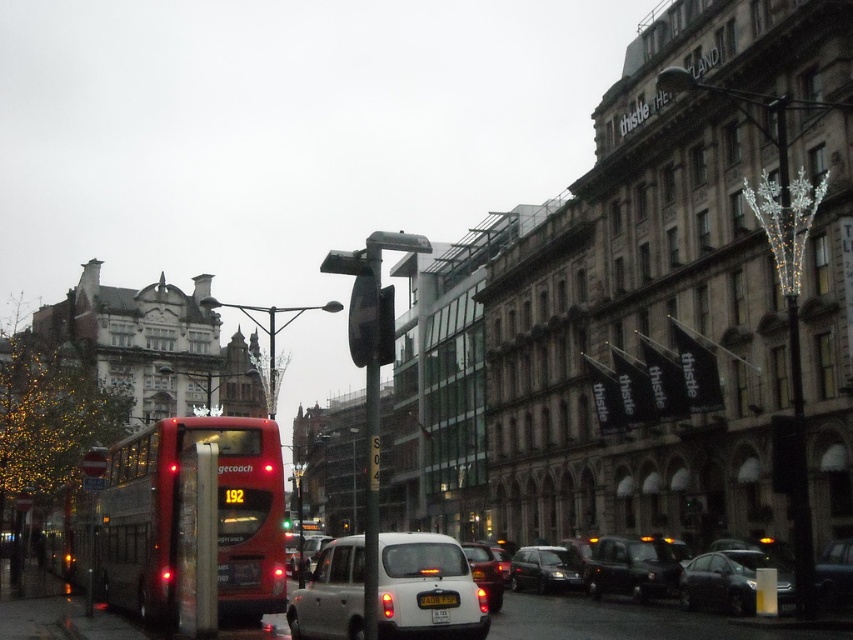
You are a pedestrian standing on the sidewalk and want to cross the street to reach the Thistle building. There is a white matte taxi at center and a metallic silver car at center in your path. Which vehicle should you move around first to reach the building safely?

The white matte taxi at center is closer to the viewer than the metallic silver car at center, so you should move around the white matte taxi at center first to reach the Thistle building safely.

You are a tourist in the city and notice two license plates on the bus. Which license plate, the white plastic license plate at center or the yellow matte license plate at center, is positioned to the right side of the bus?

The yellow matte license plate at center is positioned to the right side of the bus because the white plastic license plate at center is to the left of it.

You are standing at the point closest to the bus in this urban scene. Which of the two points, point (421, 600) or point (447, 620), is closer to you?

Point (421, 600) is closer to you because it is in front of point (447, 620).